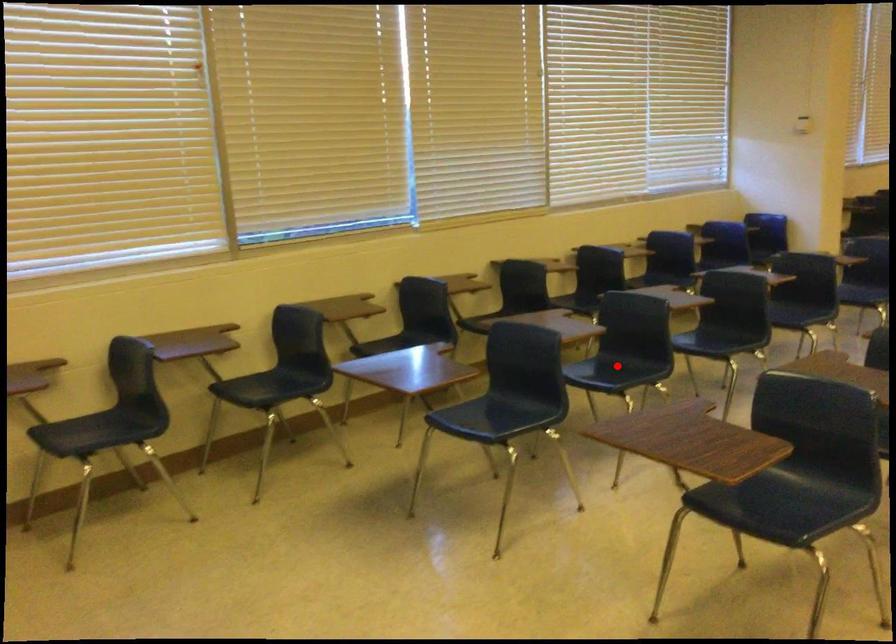
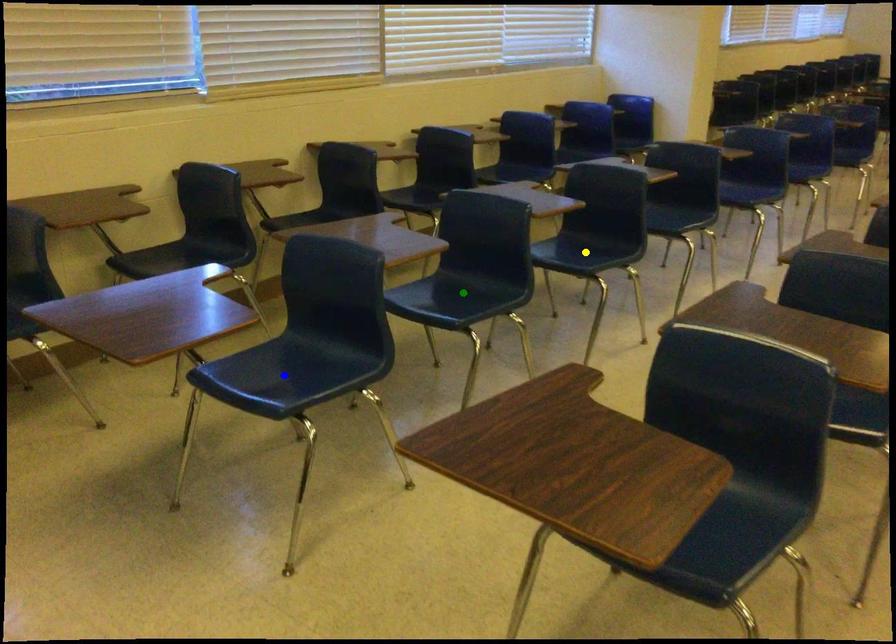
Question: I am providing you with two images of the same scene from different viewpoints. A red point is marked on the first image. You are given multiple points on the second image. Which point in image 2 represents the same 3d spot as the red point in image 1?

Choices:
 (A) blue point
 (B) green point
 (C) yellow point

Answer: (B)